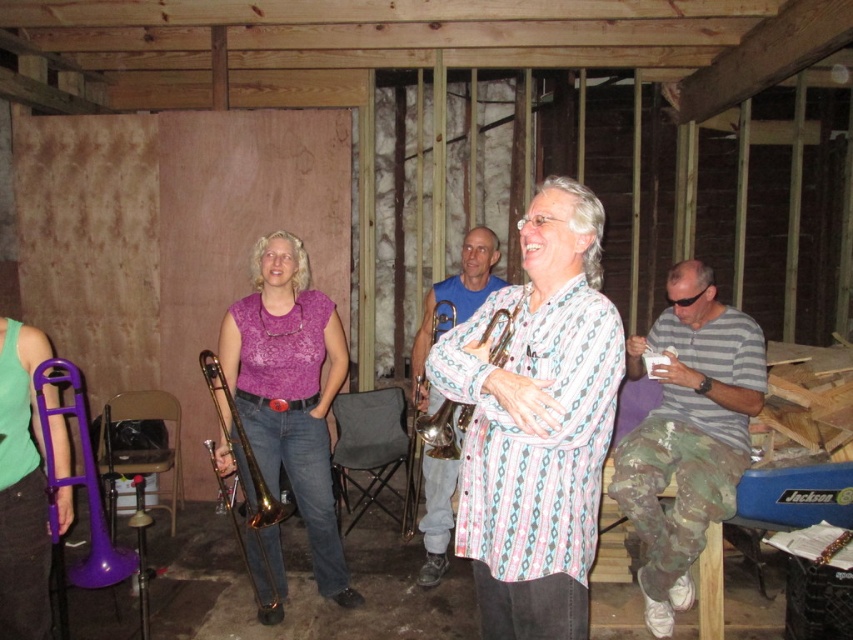
You are a photographer setting up for a band photo shoot. You need to position a microphone stand between the gold brass trombone at center and the gold shiny trumpet at center. Based on their positions, which instrument should the microphone stand be placed to the left of?

The microphone stand should be placed to the left of the gold shiny trumpet at center because the gold brass trombone at center is on the left side of the gold shiny trumpet at center.